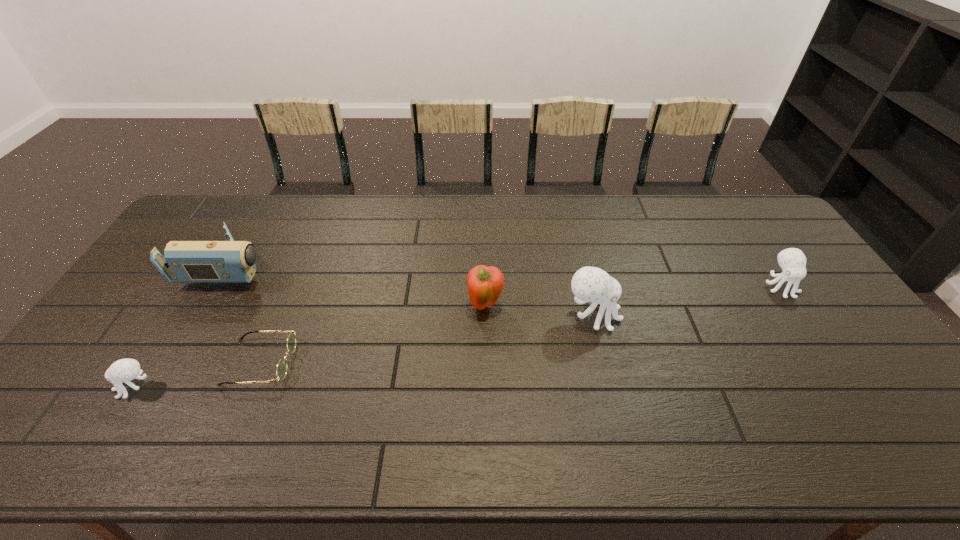
At what (x,y) coordinates should I click in order to perform the action: click on vacant space located on the front-facing side of the leftmost octopus. Please return your answer as a coordinate pair (x, y). Looking at the image, I should click on (81, 387).

Identify the location of vacant region located 0.120m on the front-facing side of the leftmost octopus. (68, 387).

Where is `free region located 0.060m on the front-facing side of the fifth object from left to right`? free region located 0.060m on the front-facing side of the fifth object from left to right is located at coordinates (641, 315).

The image size is (960, 540). In order to click on vacant position located on the front-facing side of the rightmost object in this screenshot , I will do tap(815, 338).

Where is `vacant space positioned 0.350m on the side of the camcorder with the flip-out screen`? This screenshot has height=540, width=960. vacant space positioned 0.350m on the side of the camcorder with the flip-out screen is located at coordinates (385, 267).

The height and width of the screenshot is (540, 960). What are the coordinates of `blank area located on the lenses of the spectacles` in the screenshot? It's located at (384, 362).

Where is `free space located on the left of the fourth object from left to right`? free space located on the left of the fourth object from left to right is located at coordinates (406, 306).

Image resolution: width=960 pixels, height=540 pixels. Identify the location of octopus that is at the near edge. (124, 370).

The height and width of the screenshot is (540, 960). In order to click on spectacles that is at the near edge in this screenshot , I will do `click(281, 370)`.

The height and width of the screenshot is (540, 960). What are the coordinates of `octopus that is at the left edge` in the screenshot? It's located at (124, 370).